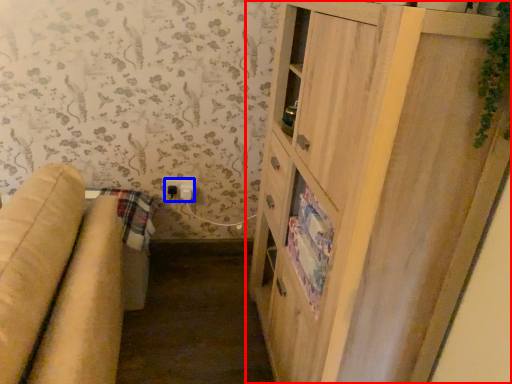
Question: Which point is further to the camera, cupboard (highlighted by a red box) or electric outlet (highlighted by a blue box)?

Choices:
 (A) cupboard
 (B) electric outlet

Answer: (B)